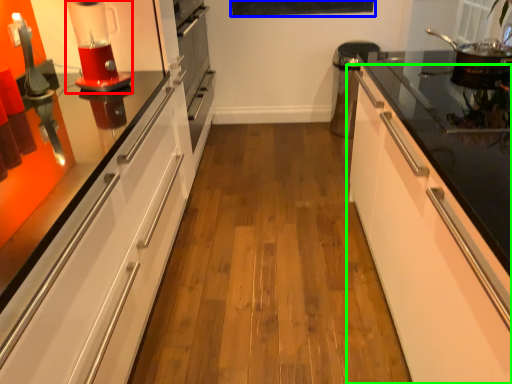
Question: Which object is positioned farthest from home appliance (highlighted by a red box)? Select from bulletin board (highlighted by a blue box) and cabinetry (highlighted by a green box).

Choices:
 (A) bulletin board
 (B) cabinetry

Answer: (A)